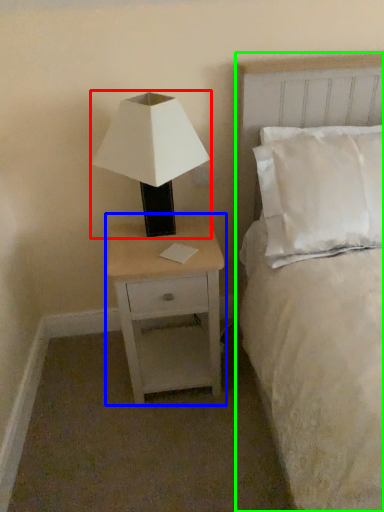
Question: Which object is positioned farthest from lamp (highlighted by a red box)? Select from nightstand (highlighted by a blue box) and bed (highlighted by a green box).

Choices:
 (A) nightstand
 (B) bed

Answer: (B)